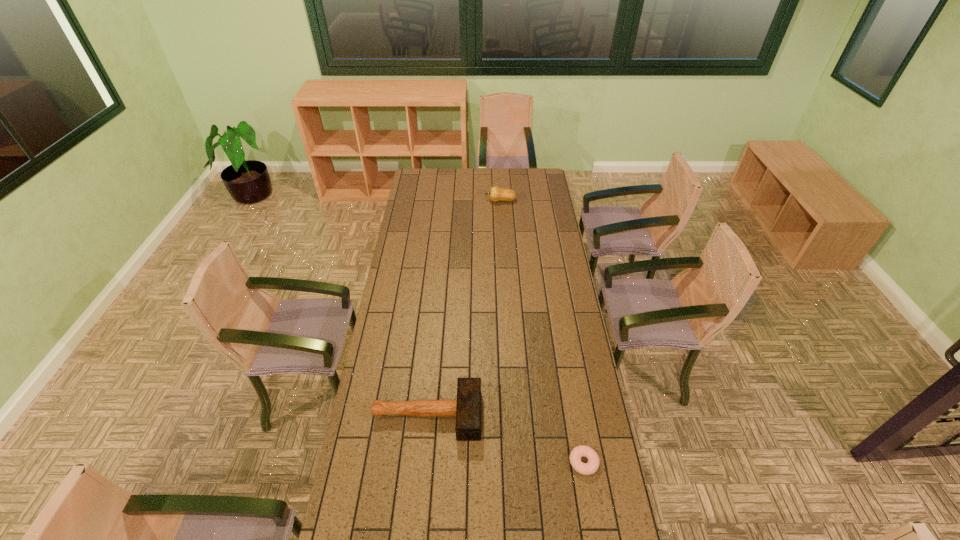
I want to click on free space that satisfies the following two spatial constraints: 1. on the hammer head face of the nearest object; 2. on the left side of the mallet, so click(x=422, y=462).

Find the location of a particular element. The width and height of the screenshot is (960, 540). free space that satisfies the following two spatial constraints: 1. on the hammer head face of the leftmost object; 2. on the right side of the doughnut is located at coordinates (422, 462).

The width and height of the screenshot is (960, 540). I want to click on vacant space that satisfies the following two spatial constraints: 1. on the stem side of the second object from right to left; 2. on the right side of the doughnut, so click(x=516, y=462).

Locate an element on the screen. The image size is (960, 540). free location that satisfies the following two spatial constraints: 1. on the hammer head face of the mallet; 2. on the right side of the nearest object is located at coordinates (422, 462).

Identify the location of vacant region that satisfies the following two spatial constraints: 1. on the stem side of the gourd; 2. on the back side of the doughnut. (516, 462).